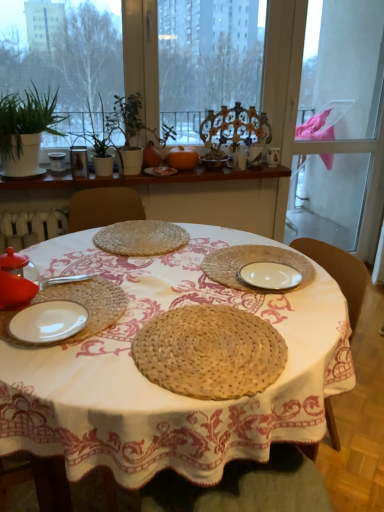
Question: From a real-world perspective, is green matte plant at upper center, the 2th plant when ordered from left to right, physically below matte brown bowl at center, the third tableware from the bottom?

Choices:
 (A) yes
 (B) no

Answer: (B)

Question: Does green matte plant at upper center, the 2th plant when ordered from left to right, lie behind matte brown bowl at center, the 3th tableware in the top-to-bottom sequence?

Choices:
 (A) no
 (B) yes

Answer: (A)

Question: Is green matte plant at upper center, the 2th plant when ordered from left to right, positioned with its back to matte brown bowl at center, which is counted as the 3th tableware, starting from the back?

Choices:
 (A) yes
 (B) no

Answer: (B)

Question: Could you tell me if green matte plant at upper center, which is the 1th plant in right-to-left order, is turned towards matte brown bowl at center, the third tableware viewed from the right?

Choices:
 (A) yes
 (B) no

Answer: (B)

Question: Considering the relative sizes of green matte plant at upper center, which is the 1th plant in right-to-left order, and matte brown bowl at center, the third tableware from the bottom, in the image provided, is green matte plant at upper center, which is the 1th plant in right-to-left order, shorter than matte brown bowl at center, the third tableware from the bottom,?

Choices:
 (A) no
 (B) yes

Answer: (A)

Question: Based on their sizes in the image, would you say matte ceramic mug at upper center, which is the first tableware in top-to-bottom order, is bigger or smaller than green matte plant at upper left, positioned as the 2th plant in right-to-left order?

Choices:
 (A) big
 (B) small

Answer: (B)

Question: From a real-world perspective, is matte ceramic mug at upper center, placed as the first tableware when sorted from back to front, physically located above or below green matte plant at upper left, positioned as the 2th plant in right-to-left order?

Choices:
 (A) below
 (B) above

Answer: (A)

Question: Is matte ceramic mug at upper center, which is the first tableware in top-to-bottom order, in front of or behind green matte plant at upper left, positioned as the 2th plant in right-to-left order, in the image?

Choices:
 (A) front
 (B) behind

Answer: (B)

Question: Would you say matte ceramic mug at upper center, the fifth tableware in the bottom-to-top sequence, is inside or outside green matte plant at upper left, which is the first plant in left-to-right order?

Choices:
 (A) outside
 (B) inside

Answer: (A)

Question: Is white matte plate at lower left, the 2th plate positioned from the bottom, spatially inside transparent glass screen door at right, or outside of it?

Choices:
 (A) outside
 (B) inside

Answer: (A)

Question: Is point (119, 310) closer or farther from the camera than point (365, 207)?

Choices:
 (A) farther
 (B) closer

Answer: (B)

Question: In the image, is white matte plate at lower left, acting as the first plate starting from the front, on the left side or the right side of transparent glass screen door at right?

Choices:
 (A) left
 (B) right

Answer: (A)

Question: Is white matte plate at lower left, acting as the first plate starting from the front, taller or shorter than transparent glass screen door at right?

Choices:
 (A) tall
 (B) short

Answer: (B)

Question: Relative to white woven plate at center, which ranks as the 3th plate in top-to-bottom order, is orange matte pumpkin at center in front or behind?

Choices:
 (A) behind
 (B) front

Answer: (A)

Question: Is orange matte pumpkin at center taller or shorter than white woven plate at center, which is the 3th plate in bottom-to-top order?

Choices:
 (A) short
 (B) tall

Answer: (B)